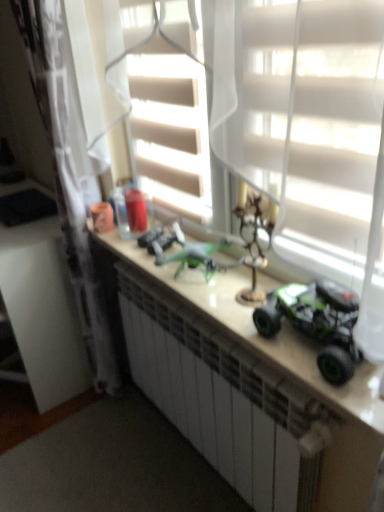
Question: Is metallic green drone at center, the second toy in the right-to-left sequence, aimed at green matte toy car at center, the first toy in the left-to-right sequence?

Choices:
 (A) yes
 (B) no

Answer: (B)

Question: Can you confirm if metallic green drone at center, the second toy in the left-to-right sequence, is taller than green matte toy car at center, the third toy from the right?

Choices:
 (A) no
 (B) yes

Answer: (B)

Question: Can you confirm if metallic green drone at center, positioned as the 2th toy in front-to-back order, is thinner than green matte toy car at center, the third toy from the right?

Choices:
 (A) no
 (B) yes

Answer: (B)

Question: Does metallic green drone at center, the second toy in the left-to-right sequence, come behind green matte toy car at center, the 1th toy positioned from the back?

Choices:
 (A) no
 (B) yes

Answer: (A)

Question: Can you confirm if metallic green drone at center, the second toy in the left-to-right sequence, is wider than green matte toy car at center, the 1th toy positioned from the back?

Choices:
 (A) yes
 (B) no

Answer: (B)

Question: Is metallic green drone at center, positioned as the 2th toy in front-to-back order, not inside green matte toy car at center, the first toy in the left-to-right sequence?

Choices:
 (A) no
 (B) yes

Answer: (B)

Question: Is green plastic toy car at center located outside green matte toy car at right, the 1th toy from the right?

Choices:
 (A) yes
 (B) no

Answer: (A)

Question: Considering the relative positions of green plastic toy car at center and green matte toy car at right, marked as the third toy in a left-to-right arrangement, in the image provided, is green plastic toy car at center to the right of green matte toy car at right, marked as the third toy in a left-to-right arrangement, from the viewer's perspective?

Choices:
 (A) no
 (B) yes

Answer: (A)

Question: From the image's perspective, is green plastic toy car at center below green matte toy car at right, the first toy positioned from the front?

Choices:
 (A) no
 (B) yes

Answer: (B)

Question: Considering the relative positions of green plastic toy car at center and green matte toy car at right, the 1th toy from the right, in the image provided, is green plastic toy car at center behind green matte toy car at right, the 1th toy from the right,?

Choices:
 (A) yes
 (B) no

Answer: (A)

Question: Is green plastic toy car at center surrounding green matte toy car at right, which is counted as the 3th toy, starting from the back?

Choices:
 (A) yes
 (B) no

Answer: (B)

Question: Does green plastic toy car at center come in front of green matte toy car at right, the first toy positioned from the front?

Choices:
 (A) no
 (B) yes

Answer: (A)

Question: Does metallic green drone at center, the second toy in the left-to-right sequence, have a smaller size compared to green matte toy car at right, the first toy positioned from the front?

Choices:
 (A) no
 (B) yes

Answer: (B)